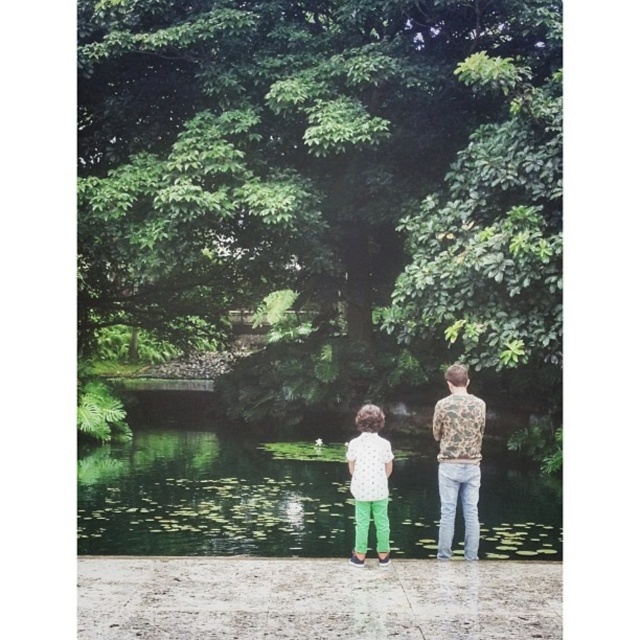
Can you confirm if green lily pads at center is shorter than polka dot shirt at center?

No, green lily pads at center is not shorter than polka dot shirt at center.

Who is lower down, green lily pads at center or polka dot shirt at center?

green lily pads at center is below.

You are a GUI agent. You are given a task and a screenshot of the screen. Output one action in this format:
    pyautogui.click(x=<x>, y=<y>)
    Task: Click on the green lily pads at center
    
    Given the screenshot: What is the action you would take?
    [x=212, y=497]

Does green lily pads at center lie behind camouflage-patterned shirt at center?

No.

Between green lily pads at center and camouflage-patterned shirt at center, which one appears on the left side from the viewer's perspective?

From the viewer's perspective, green lily pads at center appears more on the left side.

I want to click on green lily pads at center, so click(212, 497).

Looking at this image, is camouflage-patterned shirt at center further to camera compared to polka dot shirt at center?

Yes, camouflage-patterned shirt at center is behind polka dot shirt at center.

Where is `camouflage-patterned shirt at center`? camouflage-patterned shirt at center is located at coordinates (458, 460).